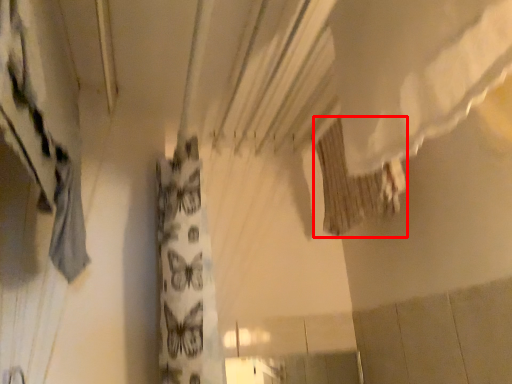
Question: Where is shower curtain (annotated by the red box) located in relation to curtain in the image?

Choices:
 (A) right
 (B) left

Answer: (A)